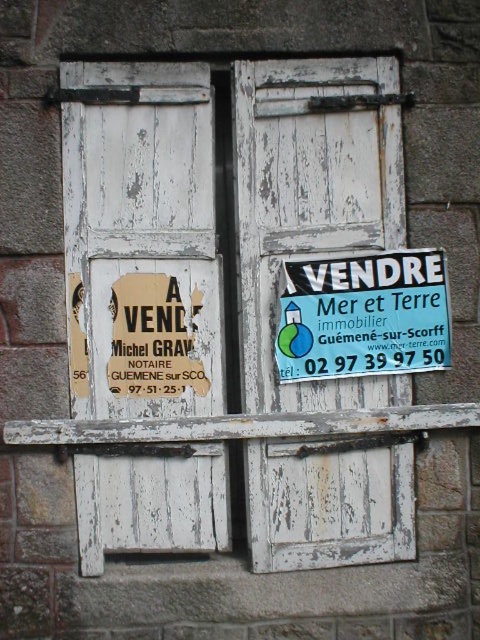
Question: Is white wooden door at left positioned in front of white wooden door at center?

Choices:
 (A) yes
 (B) no

Answer: (A)

Question: Is white wooden door at left closer to camera compared to white wooden door at center?

Choices:
 (A) no
 (B) yes

Answer: (B)

Question: Can you confirm if white wooden door at left is smaller than blue plastic sign at center?

Choices:
 (A) yes
 (B) no

Answer: (B)

Question: Which object is the closest to the white wooden door at center?

Choices:
 (A) white wooden door at left
 (B) blue plastic sign at center

Answer: (B)

Question: Which point is farther to the camera?

Choices:
 (A) blue plastic sign at center
 (B) white wooden door at center

Answer: (A)

Question: Which of the following is the farthest from the observer?

Choices:
 (A) blue plastic sign at center
 (B) white wooden door at center

Answer: (A)